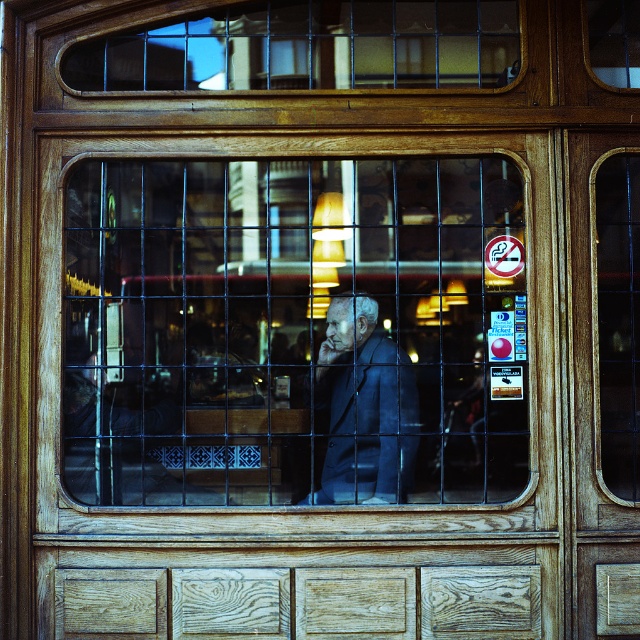
You are a painter standing in front of the window. You want to paint the scene outside the matte glass window at center. However, you notice the dark blue suit at center is blocking your view. Is the window above or below the suit?

The matte glass window at center is above the dark blue suit at center, so the window is above the suit and not blocking your view.

Consider the image. You are standing outside the wooden window and see the matte glass window at center and the dark blue suit at center. From your perspective outside, which object is more to the left?

The matte glass window at center is positioned on the left side of dark blue suit at center, so from your perspective outside, the matte glass window at center is more to the left.